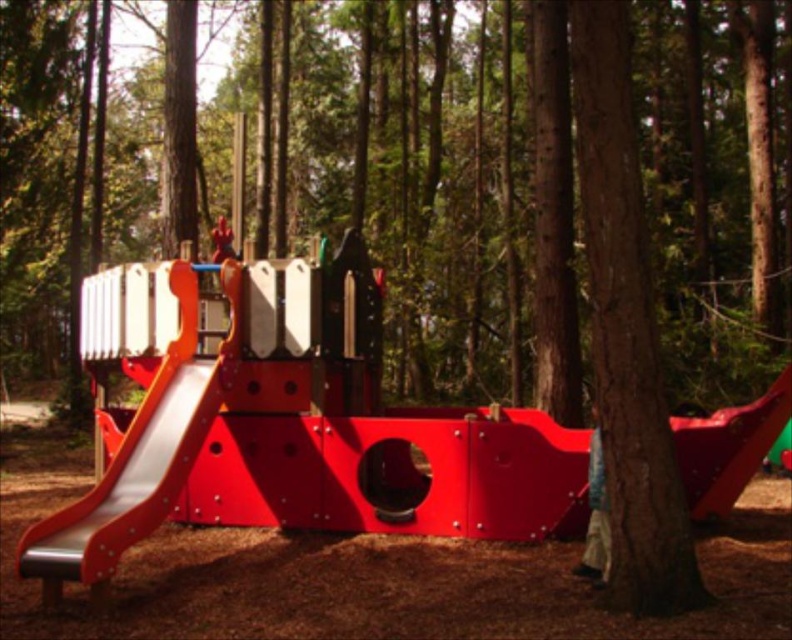
Question: Which of these objects is positioned farthest from the denim pants at lower right?

Choices:
 (A) metallic smooth slide at left
 (B) red plastic child at center

Answer: (B)

Question: Does metallic smooth slide at left have a lesser width compared to denim pants at lower right?

Choices:
 (A) yes
 (B) no

Answer: (B)

Question: Which point is closer to the camera?

Choices:
 (A) denim pants at lower right
 (B) red plastic child at center

Answer: (A)

Question: Which object is positioned closest to the red plastic child at center?

Choices:
 (A) denim pants at lower right
 (B) metallic smooth slide at left

Answer: (B)

Question: Is metallic smooth slide at left in front of denim pants at lower right?

Choices:
 (A) yes
 (B) no

Answer: (B)

Question: In this image, where is metallic smooth slide at left located relative to denim pants at lower right?

Choices:
 (A) right
 (B) left

Answer: (B)